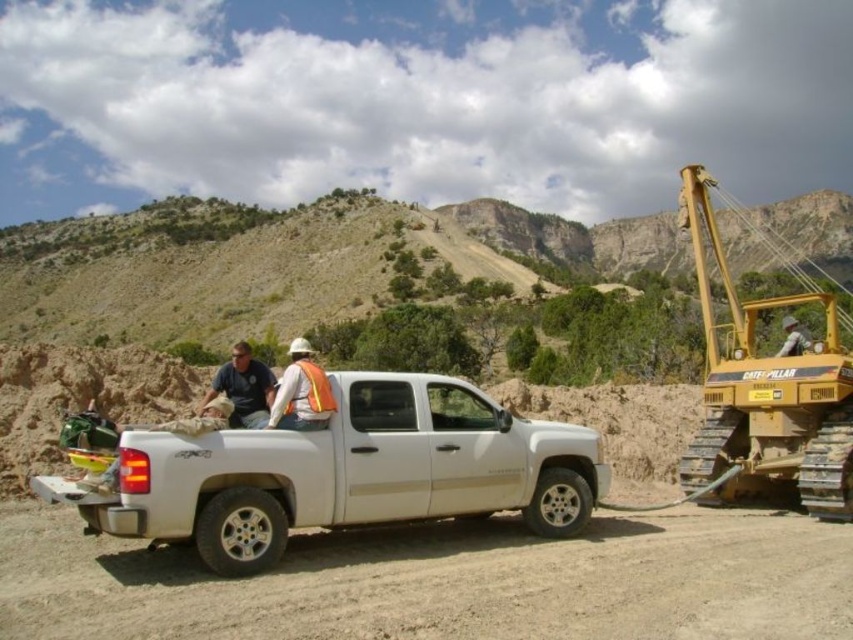
Question: Is brown sandy dirt track at lower center positioned at the back of orange reflective vest at center?

Choices:
 (A) yes
 (B) no

Answer: (B)

Question: Which object is the closest to the orange reflective vest at center?

Choices:
 (A) matte blue shirt at center
 (B) yellow metallic excavator at right
 (C) hi-visibility fabric safety vest at center
 (D) brown sandy dirt track at lower center

Answer: (A)

Question: Observing the image, what is the correct spatial positioning of white matte truck at center in reference to matte blue shirt at center?

Choices:
 (A) left
 (B) right

Answer: (B)

Question: Which object is positioned closest to the hi-visibility fabric safety vest at center?

Choices:
 (A) yellow metallic excavator at right
 (B) matte blue shirt at center

Answer: (B)

Question: Which is farther from the brown sandy dirt track at lower center?

Choices:
 (A) orange reflective vest at center
 (B) yellow metallic excavator at right
 (C) white matte truck at center
 (D) hi-visibility fabric safety vest at center

Answer: (B)

Question: Can you confirm if matte blue shirt at center is wider than hi-visibility fabric safety vest at center?

Choices:
 (A) no
 (B) yes

Answer: (B)